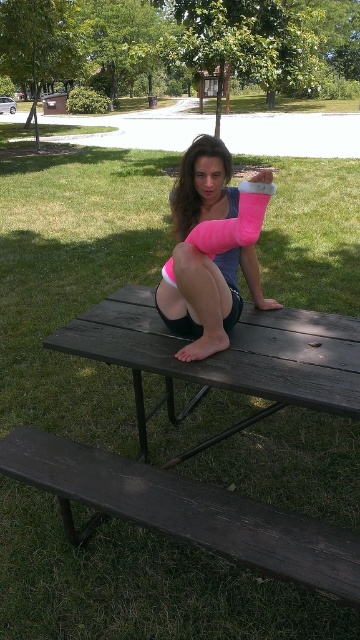
You are a photographer setting up a shot of the park scene. You need to place a small tripod between the dark brown wooden bench at lower left and the dark wood picnic table at center. Which object should the tripod be closer to to ensure it is in the foreground of the photo?

The dark brown wooden bench at lower left is closer to the viewer than the dark wood picnic table at center, so the tripod should be placed closer to the dark brown wooden bench at lower left to ensure it is in the foreground.

You are taking a photo of the scene and want to focus on both the point at coordinates point (338,579) and point (241,428). Which point should you adjust your focus to first to ensure both are in sharp view?

You should focus on point (338,579) first because it is closer to the camera than point (241,428). Adjusting focus to the closer point ensures the farther point will also be in focus.

You are a photographer setting up a tripod to take a portrait of the person sitting on the picnic table. The tripod legs are 1 meter long. You need to place the tripod on the dark brown wooden bench at lower left or the pink foam cast at center. Which surface can the tripod legs reach without extending beyond the edges?

The dark brown wooden bench at lower left is in front of the pink foam cast at center, so the tripod legs can reach the dark brown wooden bench at lower left without extending beyond its edges.